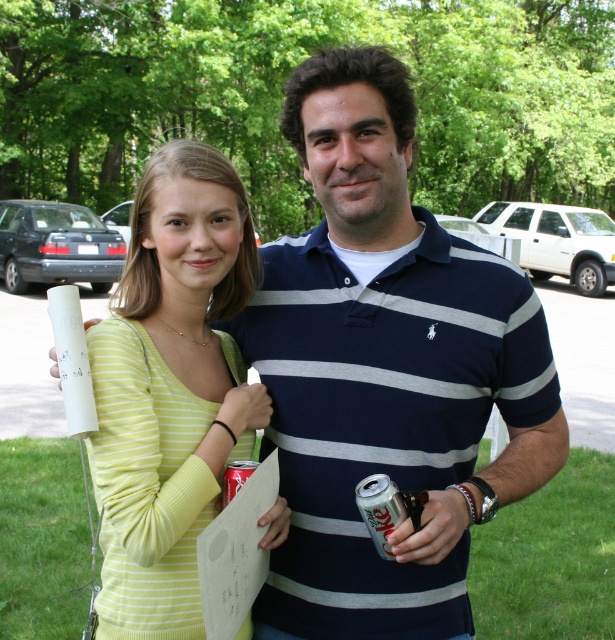
Question: Does navy blue striped polo shirt at center appear on the right side of silver metallic can at center?

Choices:
 (A) yes
 (B) no

Answer: (A)

Question: Is navy blue striped polo shirt at center thinner than yellow striped sweater at center?

Choices:
 (A) yes
 (B) no

Answer: (B)

Question: Which of the following is the closest to the observer?

Choices:
 (A) yellow striped sweater at center
 (B) silver metallic can at lower center
 (C) navy blue striped polo shirt at center

Answer: (B)

Question: Is navy blue striped polo shirt at center wider than yellow striped sweater at center?

Choices:
 (A) no
 (B) yes

Answer: (B)

Question: Which point appears farthest from the camera in this image?

Choices:
 (A) (223, 305)
 (B) (394, 525)
 (C) (237, 470)
 (D) (533, 412)

Answer: (A)

Question: Which of the following is the farthest from the observer?

Choices:
 (A) (247, 468)
 (B) (191, 451)
 (C) (303, 288)

Answer: (C)